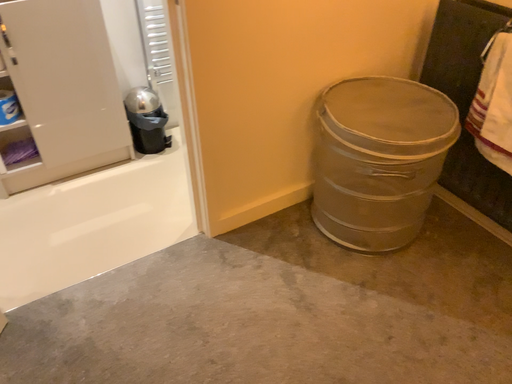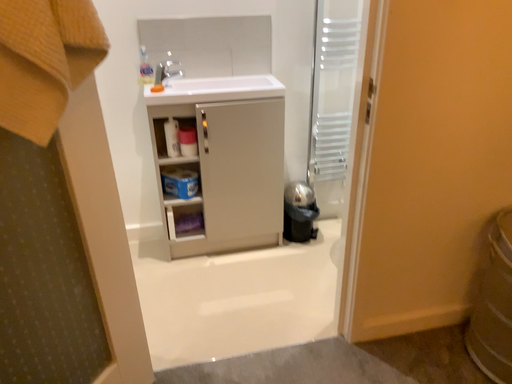
Question: Which way did the camera rotate in the video?

Choices:
 (A) rotated left
 (B) rotated right

Answer: (A)